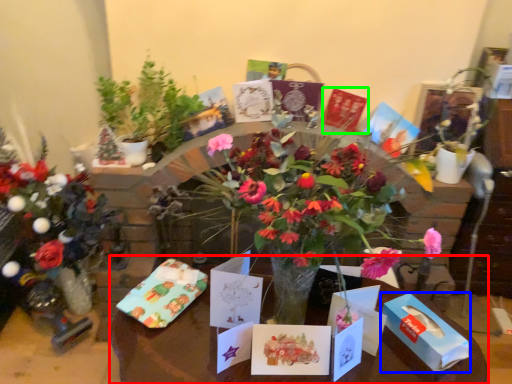
Question: Which object is positioned closest to table (highlighted by a red box)? Select from box (highlighted by a blue box) and birthday card (highlighted by a green box).

Choices:
 (A) box
 (B) birthday card

Answer: (A)